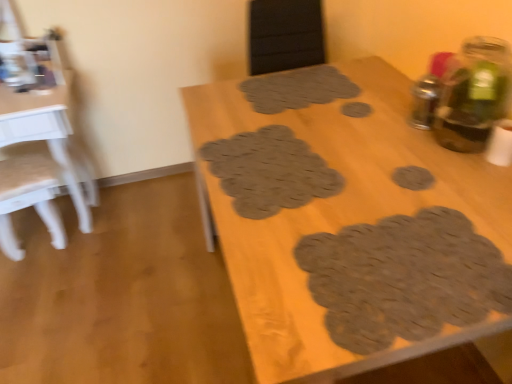
You are a GUI agent. You are given a task and a screenshot of the screen. Output one action in this format:
    pyautogui.click(x=<x>, y=<y>)
    Task: Click on the vacant area that is in front of brown textured mat at center, positioned as the 3th footprint in top-to-bottom order
    
    Given the screenshot: What is the action you would take?
    pyautogui.click(x=282, y=244)